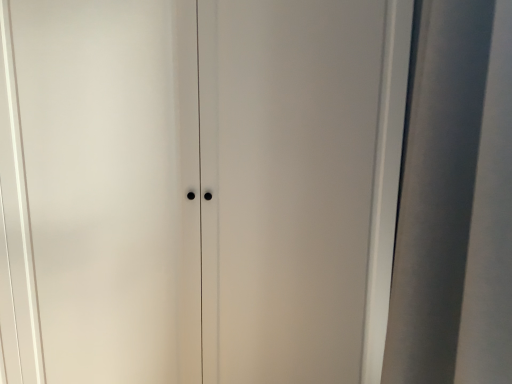
What do you see at coordinates (455, 201) in the screenshot? Image resolution: width=512 pixels, height=384 pixels. I see `satin silver screen door at right` at bounding box center [455, 201].

This screenshot has width=512, height=384. What are the coordinates of `satin silver screen door at right` in the screenshot? It's located at [x=455, y=201].

The height and width of the screenshot is (384, 512). In order to click on satin silver screen door at right in this screenshot , I will do `click(455, 201)`.